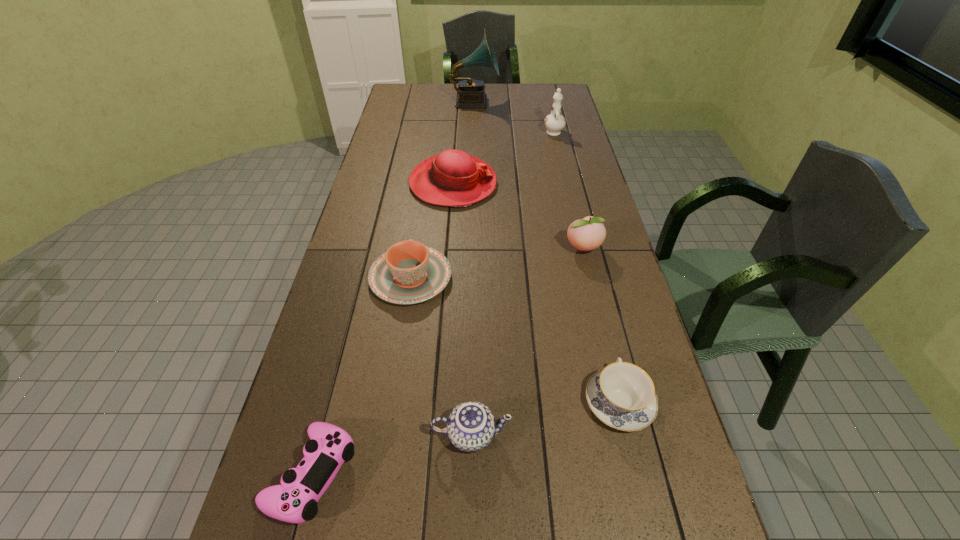
Locate an element on the screen. free space between the second farthest chinaware and the shortest chinaware is located at coordinates click(515, 340).

Image resolution: width=960 pixels, height=540 pixels. Find the location of `vacant space that is in between the hat and the third nearest chinaware`. vacant space that is in between the hat and the third nearest chinaware is located at coordinates (432, 231).

You are a GUI agent. You are given a task and a screenshot of the screen. Output one action in this format:
    pyautogui.click(x=<x>, y=<y>)
    Task: Click on the unoccupied area between the third nearest chinaware and the hat
    
    Given the screenshot: What is the action you would take?
    pyautogui.click(x=432, y=231)

The image size is (960, 540). Find the location of `vacant area that lies between the farthest object and the peach`. vacant area that lies between the farthest object and the peach is located at coordinates (529, 176).

Find the location of a particular element. free spot between the tallest object and the peach is located at coordinates (529, 176).

The image size is (960, 540). I want to click on free space between the peach and the phonograph_record, so click(529, 176).

The height and width of the screenshot is (540, 960). Find the location of `blank region between the peach and the shortest chinaware`. blank region between the peach and the shortest chinaware is located at coordinates (601, 325).

Locate an element on the screen. Image resolution: width=960 pixels, height=540 pixels. object that is the fifth closest one to the peach is located at coordinates (555, 122).

Identify the location of object that is the third nearest to the shortest chinaware. (586, 234).

Identify which chinaware is the fourth nearest to the hat. Please provide its 2D coordinates. Your answer should be formatted as a tuple, i.e. [(x, y)], where the tuple contains the x and y coordinates of a point satisfying the conditions above.

[(471, 426)]